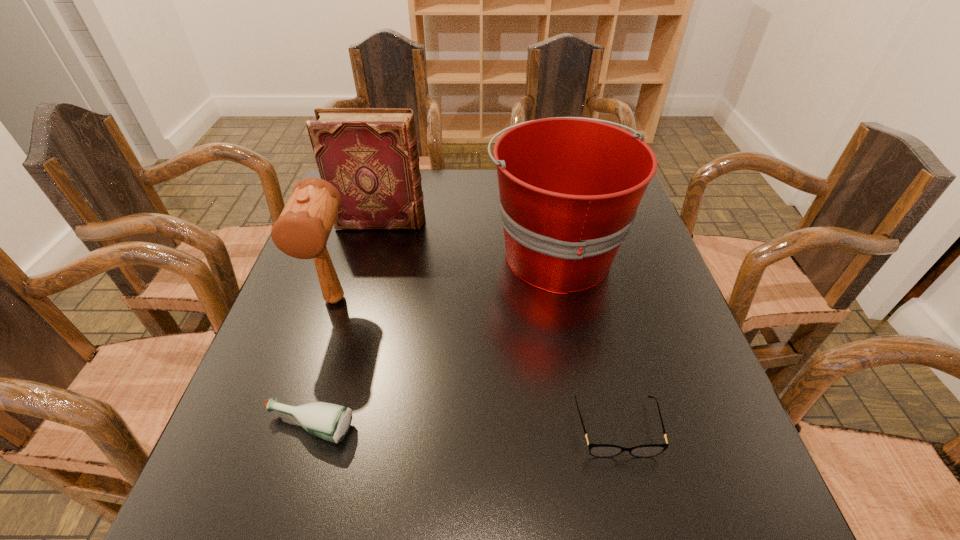
This screenshot has height=540, width=960. In order to click on hardback book that is at the left edge in this screenshot , I will do `click(369, 155)`.

The image size is (960, 540). Find the location of `mallet positioned at the left edge`. mallet positioned at the left edge is located at coordinates (302, 230).

Find the location of a particular element. Image resolution: width=960 pixels, height=540 pixels. bottle present at the left edge is located at coordinates (331, 422).

What are the coordinates of `bucket at the right edge` in the screenshot? It's located at (569, 187).

Find the location of a particular element. The image size is (960, 540). spectacles present at the right edge is located at coordinates (597, 450).

In the image, there is a desktop. Identify the location of vacant space at the far edge. The width and height of the screenshot is (960, 540). (432, 172).

At what (x,y) coordinates should I click in order to perform the action: click on blank space at the near edge of the desktop. Please return your answer as a coordinate pair (x, y). Image resolution: width=960 pixels, height=540 pixels. Looking at the image, I should click on (531, 499).

This screenshot has width=960, height=540. In order to click on vacant space at the left edge in this screenshot , I will do `click(351, 292)`.

At what (x,y) coordinates should I click in order to perform the action: click on vacant region at the right edge. Please return your answer as a coordinate pair (x, y). The height and width of the screenshot is (540, 960). Looking at the image, I should click on (657, 390).

In the image, there is a desktop. Identify the location of vacant space at the near left corner. This screenshot has height=540, width=960. (276, 526).